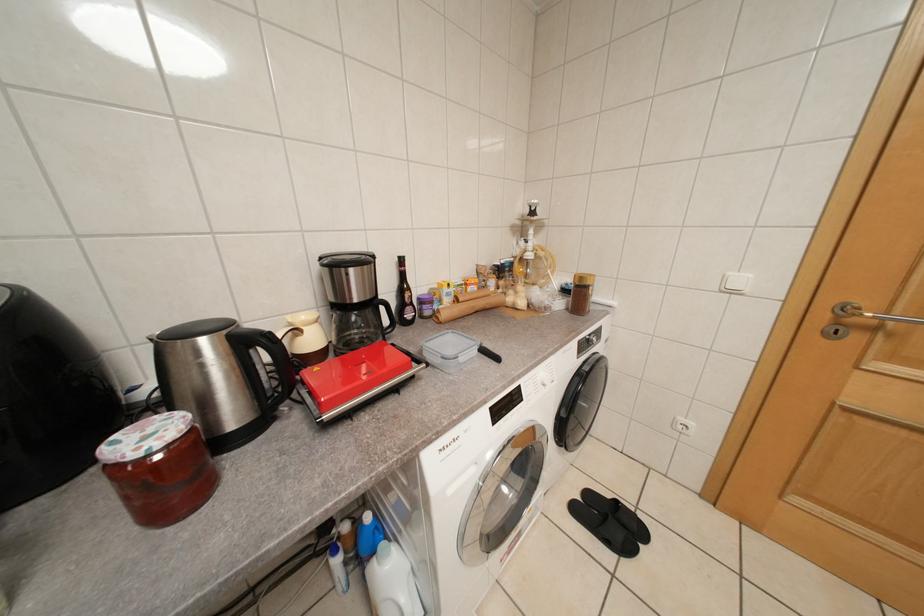
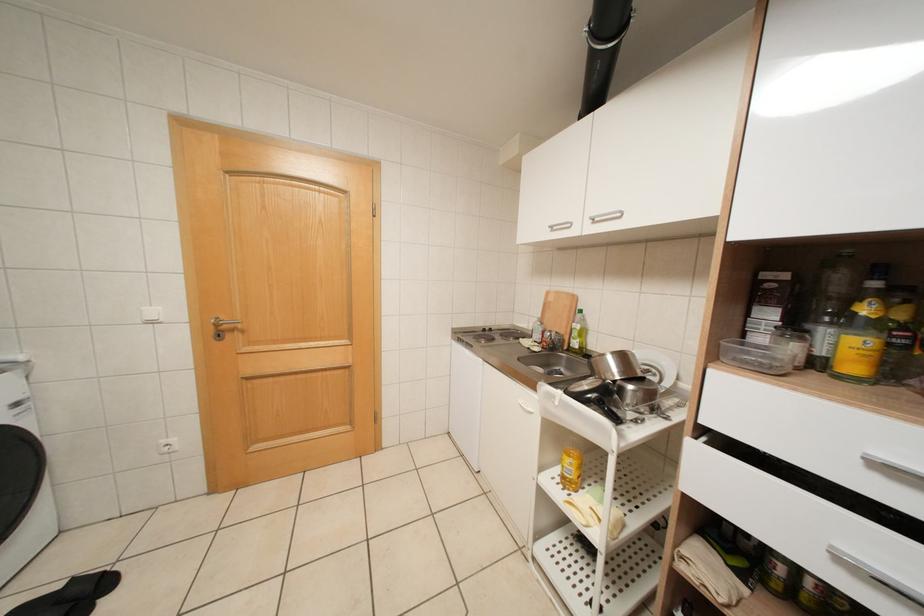
Question: The images are taken continuously from a first-person perspective. In which direction is your viewpoint rotating?

Choices:
 (A) Left
 (B) Right
 (C) Up
 (D) Down

Answer: (B)